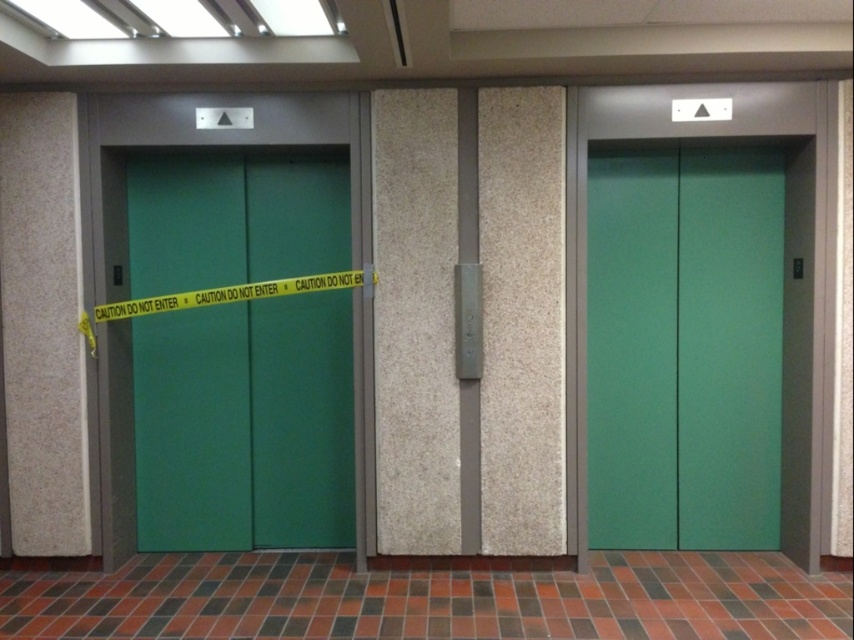
You are standing in the hallway and see the green matte elevator doors at left and the green matte elevator doors at center. Which elevator doors are closer to you?

The green matte elevator doors at left are closer to you because the green matte elevator doors at center is behind them.

You are standing in the lobby and see the green matte elevator doors at left and the green matte elevator doors at center. Which set of doors is closer to the floor?

The green matte elevator doors at left is below the green matte elevator doors at center, so the green matte elevator doors at left are closer to the floor.

You are standing in the hallway and need to locate the green matte elevator doors at left. According to the coordinates provided, where should you look?

The green matte elevator doors at left are located at point (244, 424).